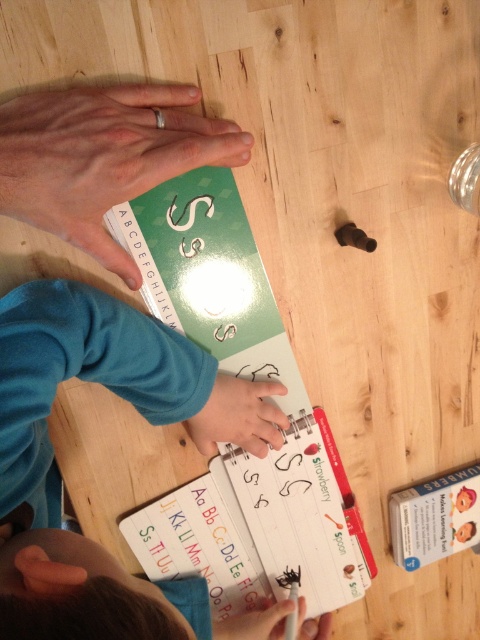
Question: Which point is farther to the camera?

Choices:
 (A) (x=279, y=355)
 (B) (x=446, y=502)
 (C) (x=196, y=433)

Answer: (B)

Question: Which object appears closest to the camera in this image?

Choices:
 (A) white matte pen at center
 (B) matte white paper at upper center

Answer: (B)

Question: Is matte white paper at upper center below white matte pen at center?

Choices:
 (A) no
 (B) yes

Answer: (A)

Question: From the image, what is the correct spatial relationship of blue fleece sweater at center in relation to white cardboard book at lower right?

Choices:
 (A) left
 (B) right

Answer: (A)

Question: Where is green paper book at center located in relation to white cardboard book at lower right in the image?

Choices:
 (A) left
 (B) right

Answer: (A)

Question: Which object is closer to the camera taking this photo?

Choices:
 (A) green paper book at center
 (B) matte white paper at upper center
 (C) white cardboard book at lower right

Answer: (B)